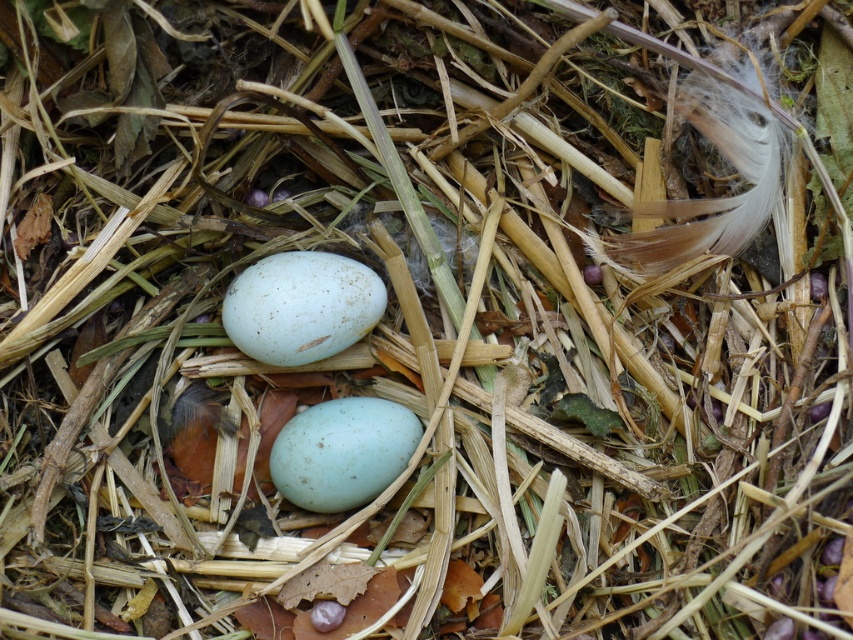
You are a photographer trying to capture a detailed shot of the two light blue eggs in the nest. You notice two points in the scene at coordinates point (264, 276) and point (364, 449). Which point should you focus on to ensure the eggs are in sharp focus?

You should focus on point (264, 276) because it is closer to the camera than point (364, 449), ensuring the eggs will be in sharp focus.

You are a wildlife researcher observing a bird nest. You notice two eggs in the nest, a speckled white egg at center and a matte blue egg at center. Which egg has a greater width?

The speckled white egg at center has a greater width than the matte blue egg at center according to the description.